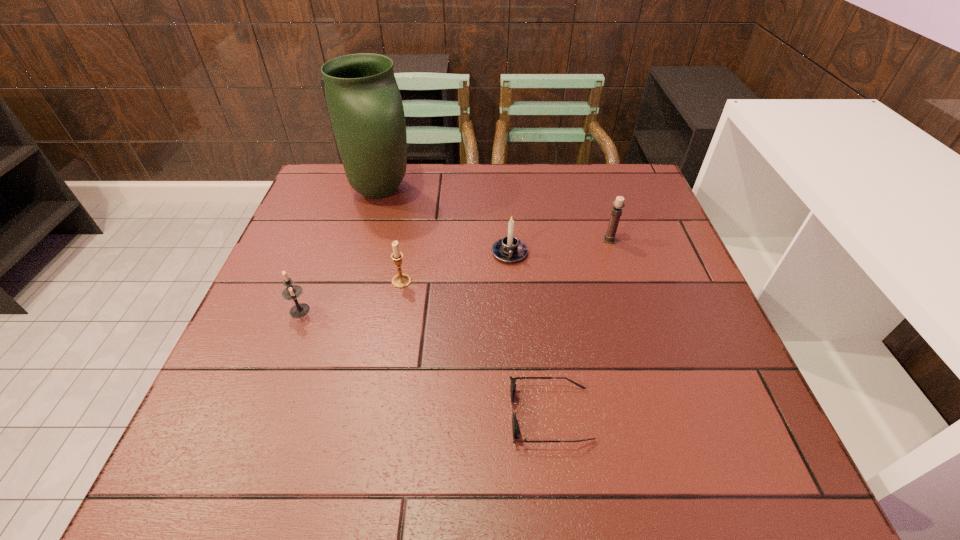
Locate an element on the screen. The height and width of the screenshot is (540, 960). candle holder identified as the closest to the second nearest candle holder is located at coordinates tap(292, 292).

Identify which candle holder is the nearest to the nearest object. Please provide its 2D coordinates. Your answer should be formatted as a tuple, i.e. [(x, y)], where the tuple contains the x and y coordinates of a point satisfying the conditions above.

[(509, 249)]